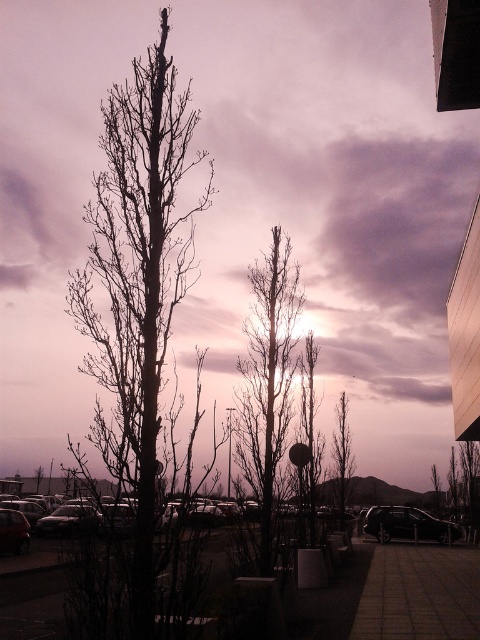
Question: Which point appears farthest from the camera in this image?

Choices:
 (A) (276, 321)
 (B) (339, 504)
 (C) (313, 496)

Answer: (B)

Question: Can you confirm if gray concrete pavement at lower right is positioned to the left of bare branches at center?

Choices:
 (A) no
 (B) yes

Answer: (A)

Question: Which object is positioned closest to the shiny black car at lower right?

Choices:
 (A) metallic silver car at center
 (B) bare branches at center
 (C) dark brown bark tree at center

Answer: (C)

Question: Can you confirm if gray concrete pavement at lower right is positioned below metallic silver car at center?

Choices:
 (A) yes
 (B) no

Answer: (A)

Question: Is shiny black car at lower right bigger than metallic silver car at center?

Choices:
 (A) no
 (B) yes

Answer: (A)

Question: Which point appears closest to the camera in this image?

Choices:
 (A) (307, 499)
 (B) (345, 401)

Answer: (A)